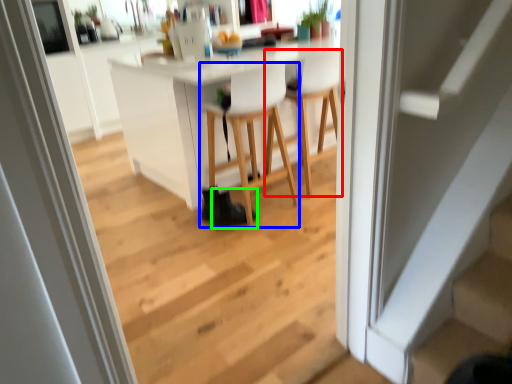
Question: Which object is positioned farthest from chair (highlighted by a red box)? Select from chair (highlighted by a blue box) and shoe (highlighted by a green box).

Choices:
 (A) chair
 (B) shoe

Answer: (B)